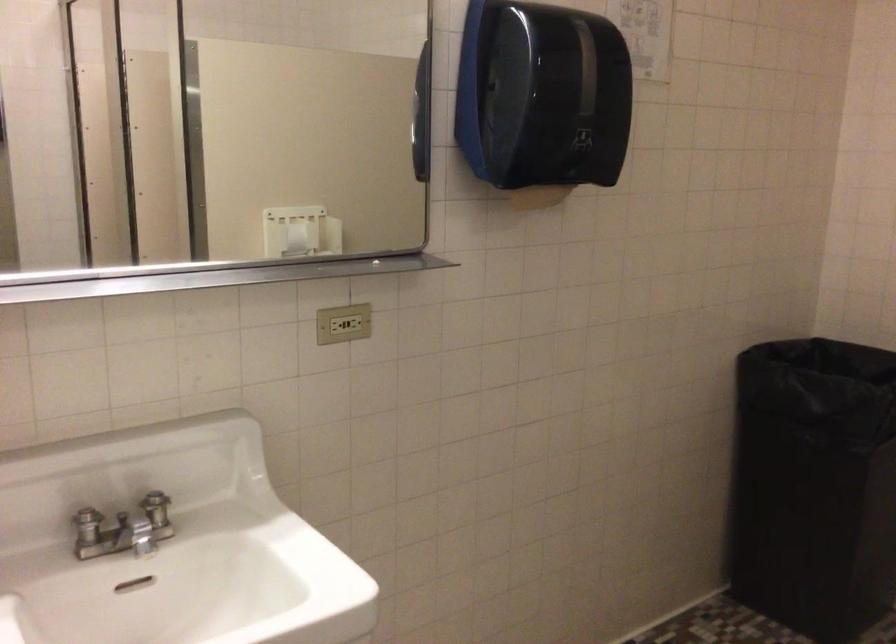
The location [342,323] corresponds to which object?

It corresponds to the electrical outlet in the image.